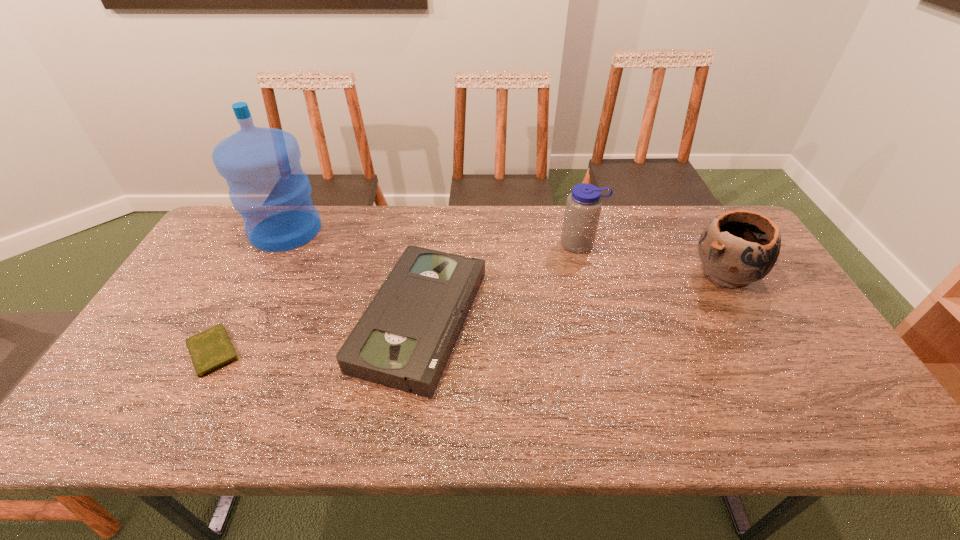
In order to click on free space located 0.150m on the right of the diary in this screenshot , I will do `click(302, 352)`.

What are the coordinates of `water jug at the far edge` in the screenshot? It's located at (x=267, y=186).

Find the location of a particular element. This screenshot has width=960, height=540. water bottle located at the far edge is located at coordinates (583, 206).

Locate an element on the screen. This screenshot has width=960, height=540. water jug at the left edge is located at coordinates (267, 186).

The width and height of the screenshot is (960, 540). Find the location of `diary that is positioned at the left edge`. diary that is positioned at the left edge is located at coordinates (211, 349).

Find the location of `object positioned at the right edge`. object positioned at the right edge is located at coordinates (738, 247).

Locate an element on the screen. object that is at the far left corner is located at coordinates (267, 186).

In the image, there is a desktop. What are the coordinates of `vacant space at the far edge` in the screenshot? It's located at (545, 228).

I want to click on free space at the near edge of the desktop, so click(x=747, y=423).

In the image, there is a desktop. At what (x,y) coordinates should I click in order to perform the action: click on vacant space at the left edge. Please return your answer as a coordinate pair (x, y). The width and height of the screenshot is (960, 540). Looking at the image, I should click on (215, 265).